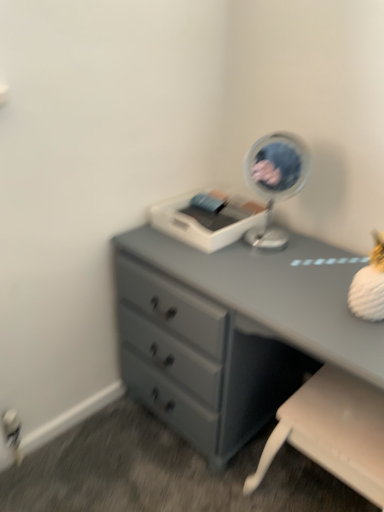
Question: From the image's perspective, is white plastic printer at center above or below matte gray dresser at center?

Choices:
 (A) above
 (B) below

Answer: (A)

Question: Is white plastic printer at center taller or shorter than matte gray dresser at center?

Choices:
 (A) tall
 (B) short

Answer: (B)

Question: Based on their relative distances, which object is nearer to the white plastic swivel chair at lower right?

Choices:
 (A) white plastic printer at center
 (B) matte gray dresser at center
 (C) metallic silver mirror at upper right

Answer: (B)

Question: Which is farther from the white plastic printer at center?

Choices:
 (A) matte gray dresser at center
 (B) metallic silver mirror at upper right
 (C) white plastic swivel chair at lower right

Answer: (C)